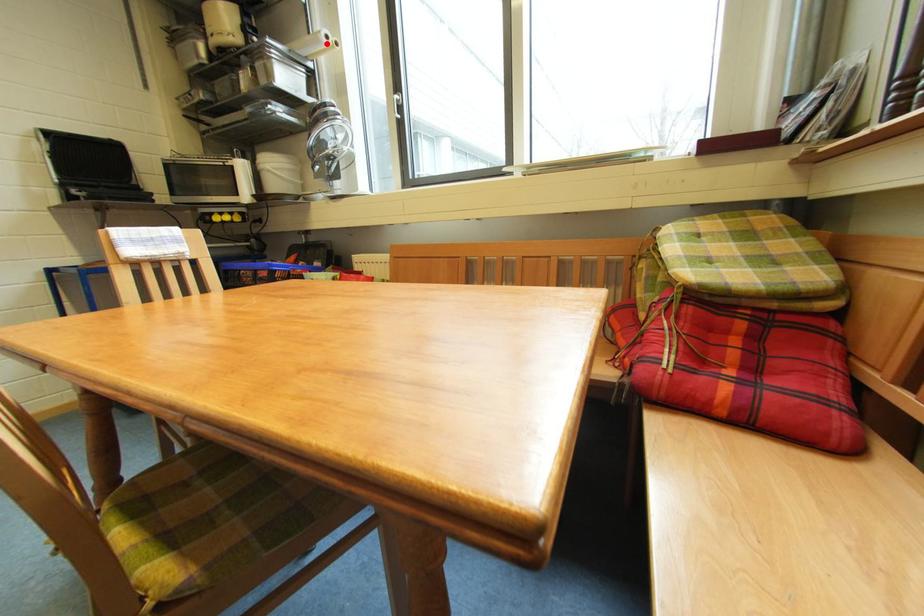
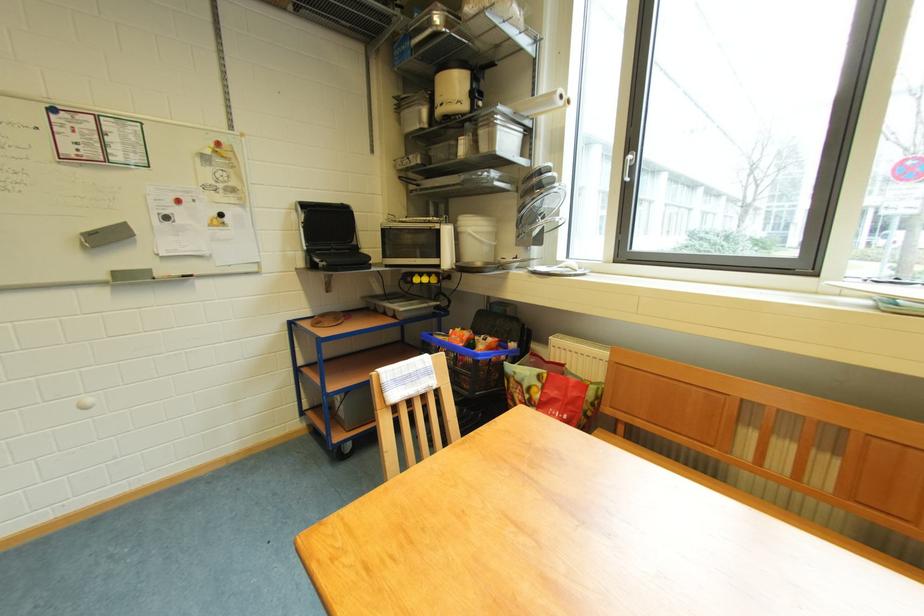
Locate, in the second image, the point that corresponds to the highlighted location in the first image.

(560, 103)